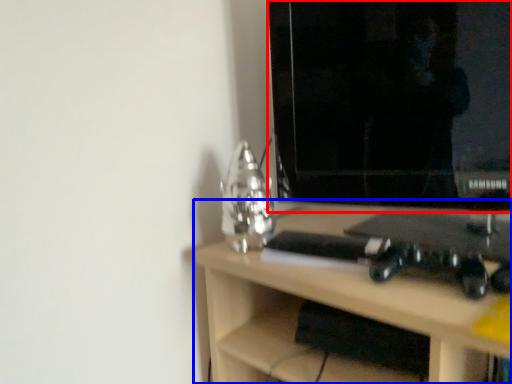
Question: Which object is further to the camera taking this photo, computer monitor (highlighted by a red box) or desk (highlighted by a blue box)?

Choices:
 (A) computer monitor
 (B) desk

Answer: (A)